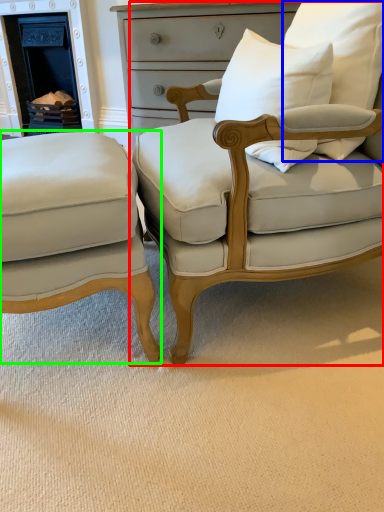
Question: Considering the real-world distances, which object is farthest from chair (highlighted by a red box)? pillow (highlighted by a blue box) or chair (highlighted by a green box)?

Choices:
 (A) pillow
 (B) chair

Answer: (B)